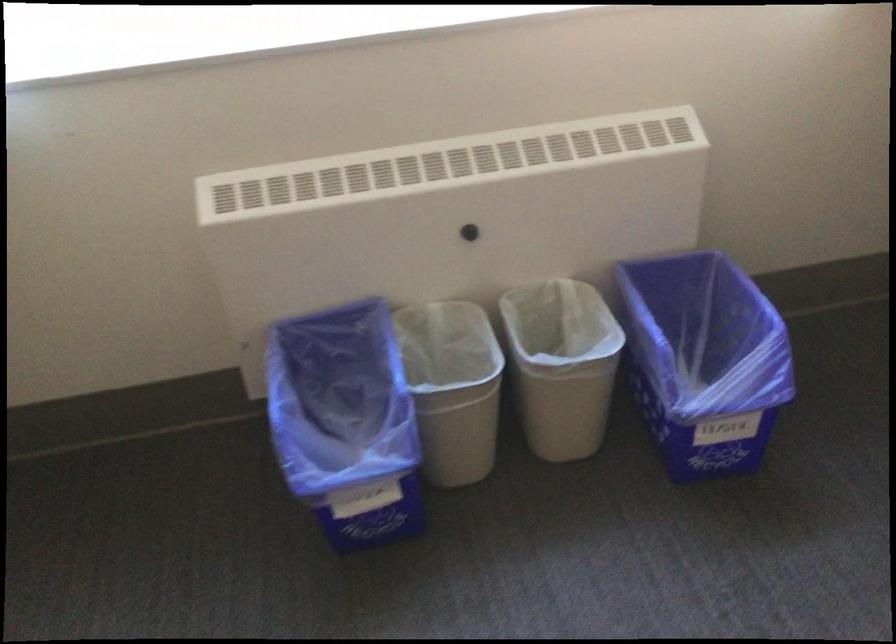
Question: Based on the continuous images, in which direction is the camera rotating? Reply with the corresponding letter.

Choices:
 (A) Left
 (B) Right
 (C) Up
 (D) Down

Answer: (B)